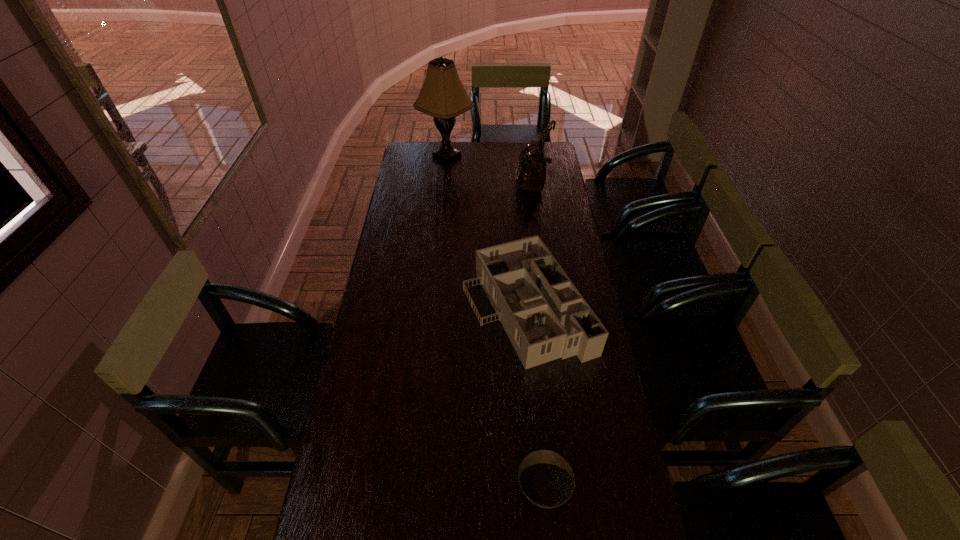
Find the location of a particular element. The height and width of the screenshot is (540, 960). vacant space at the left edge of the desktop is located at coordinates (348, 475).

In the image, there is a desktop. What are the coordinates of `free space at the right edge` in the screenshot? It's located at (575, 253).

In order to click on blank region between the third tallest object and the farthest object in this screenshot , I will do `click(487, 232)`.

At what (x,y) coordinates should I click in order to perform the action: click on empty space that is in between the shortest object and the lamp. Please return your answer as a coordinate pair (x, y). Image resolution: width=960 pixels, height=540 pixels. Looking at the image, I should click on (495, 323).

Identify the location of vacant space in between the farthest object and the third farthest object. This screenshot has width=960, height=540. (487, 232).

Where is `vacant space in between the nearest object and the tallest object`? This screenshot has width=960, height=540. vacant space in between the nearest object and the tallest object is located at coordinates (495, 323).

You are a GUI agent. You are given a task and a screenshot of the screen. Output one action in this format:
    pyautogui.click(x=<x>, y=<y>)
    Task: Click on the unoccupied area between the farthest object and the second shortest object
    
    Given the screenshot: What is the action you would take?
    pyautogui.click(x=487, y=232)

Identify the location of free spot between the lamp and the third farthest object. (487, 232).

Where is `vacant region between the shoulder bag and the lamp`? This screenshot has width=960, height=540. vacant region between the shoulder bag and the lamp is located at coordinates (491, 173).

What are the coordinates of `vacant space that's between the lamp and the third farthest object` in the screenshot? It's located at (487, 232).